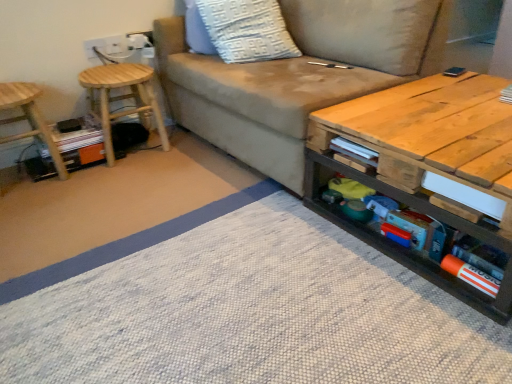
Question: In terms of size, does wooden stool at left, placed as the 2th stool when sorted from right to left, appear bigger or smaller than white textured pillow at upper center?

Choices:
 (A) small
 (B) big

Answer: (A)

Question: Is point (20, 137) positioned closer to the camera than point (288, 54)?

Choices:
 (A) closer
 (B) farther

Answer: (B)

Question: Considering the real-world distances, which object is farthest from the natural wood coffee table at center?

Choices:
 (A) white textured pillow at upper center
 (B) suede beige couch at center
 (C) wooden book at lower right, which appears as the 3th book when viewed from the right
 (D) orange matte book at lower right, positioned as the third book in top-to-bottom order
 (E) wooden stool at left, positioned as the first stool in left-to-right order

Answer: (E)

Question: Which of these objects is positioned farthest from the natural wood stool at left, the 1th stool in the right-to-left sequence?

Choices:
 (A) wooden stool at left, positioned as the first stool in left-to-right order
 (B) suede beige couch at center
 (C) white paper book at right, placed as the 1th book when sorted from back to front
 (D) natural wood coffee table at center
 (E) white textured pillow at upper center

Answer: (C)